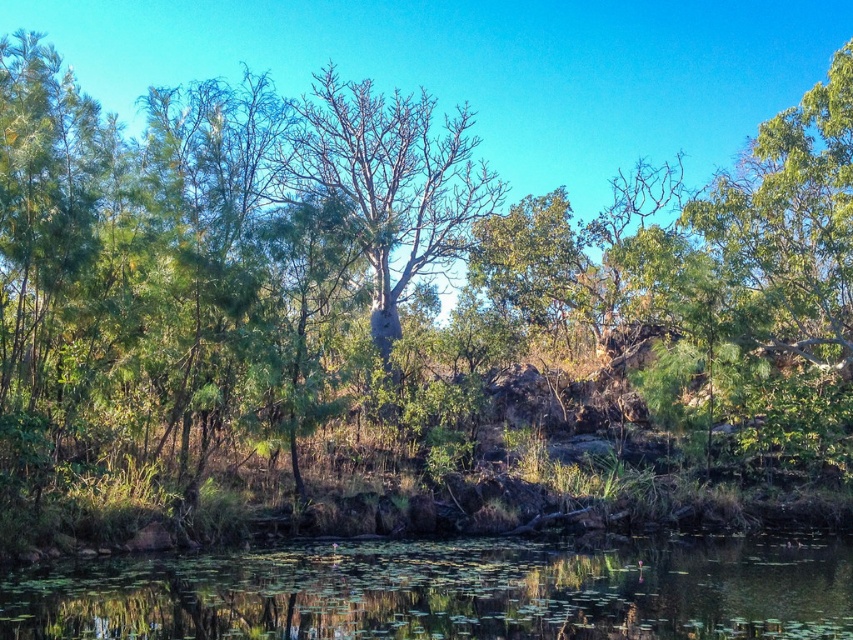
Question: Which point is closer to the camera?

Choices:
 (A) (334, 152)
 (B) (132, 636)

Answer: (B)

Question: Is green leafy water at lower center wider than bare wood tree at center?

Choices:
 (A) no
 (B) yes

Answer: (B)

Question: Does green leafy water at lower center appear on the left side of bare wood tree at center?

Choices:
 (A) no
 (B) yes

Answer: (A)

Question: Does green leafy water at lower center appear under bare wood tree at center?

Choices:
 (A) no
 (B) yes

Answer: (B)